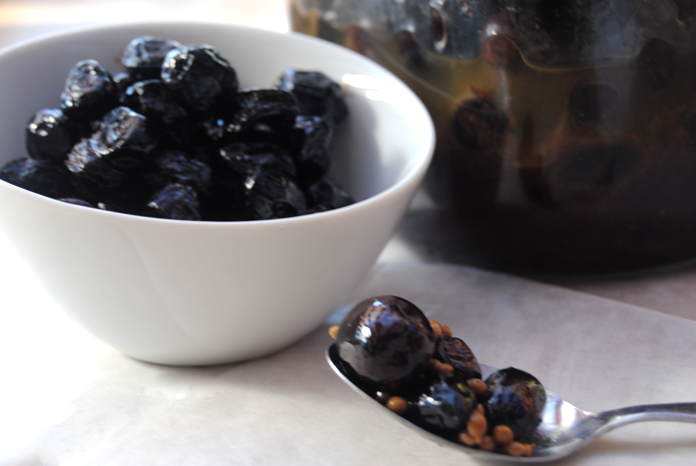
This screenshot has width=696, height=466. In order to click on spoon in this screenshot , I will do `click(569, 436)`.